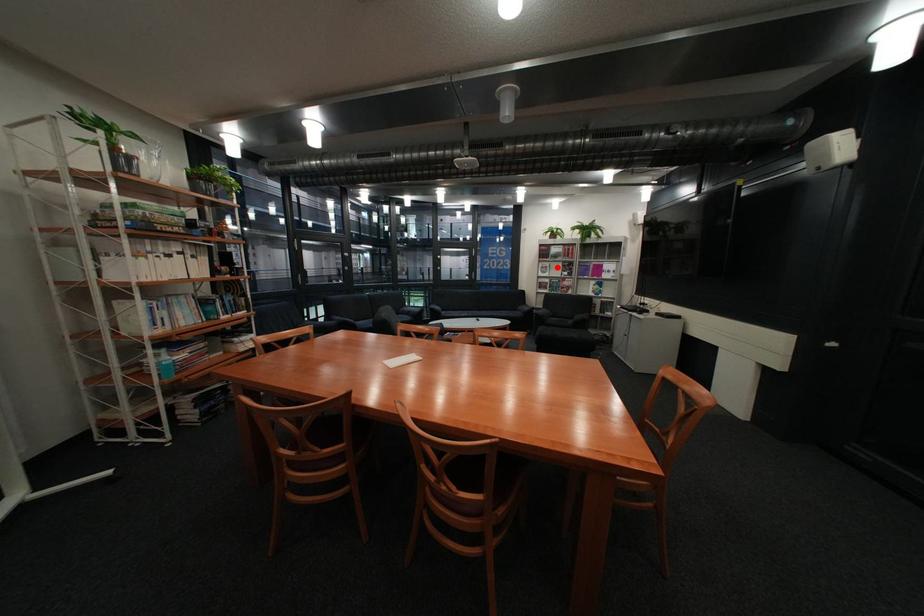
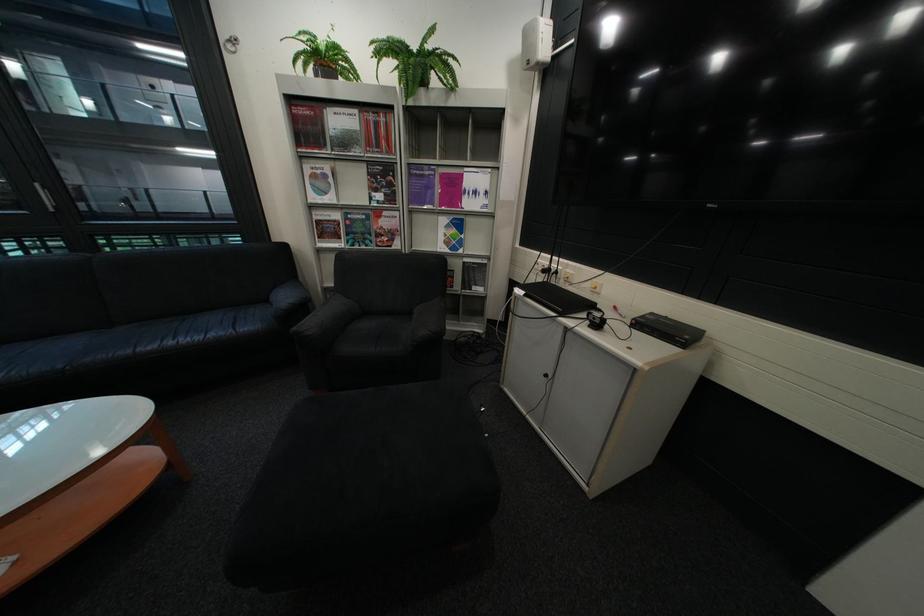
Locate, in the second image, the point that corresponds to the highlighted location in the first image.

(329, 177)